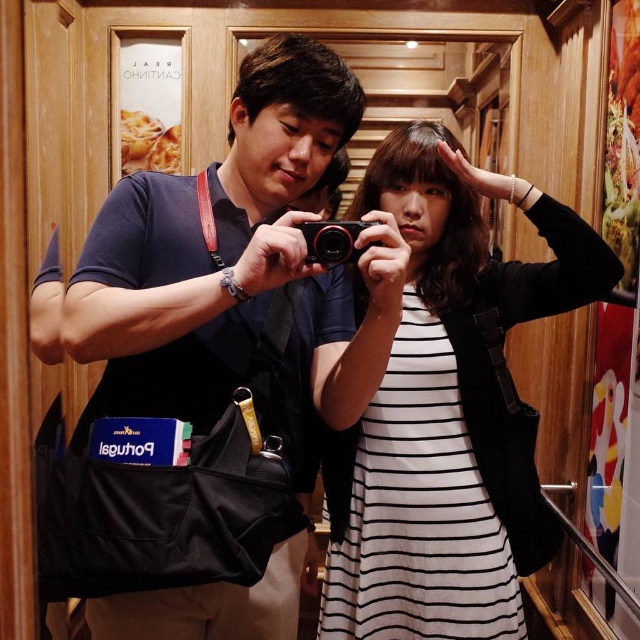
You are trying to determine which object is wider between the dark blue fabric shirt at center and the black plastic camera at center. Which one has a greater width?

The dark blue fabric shirt at center has a greater width than the black plastic camera at center.